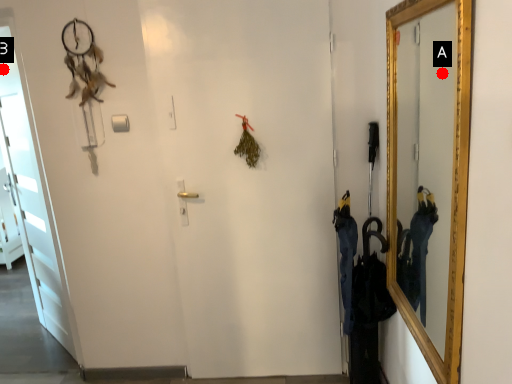
Question: Two points are circled on the image, labeled by A and B beside each circle. Among these points, which one is nearest to the camera?

Choices:
 (A) A is closer
 (B) B is closer

Answer: (A)